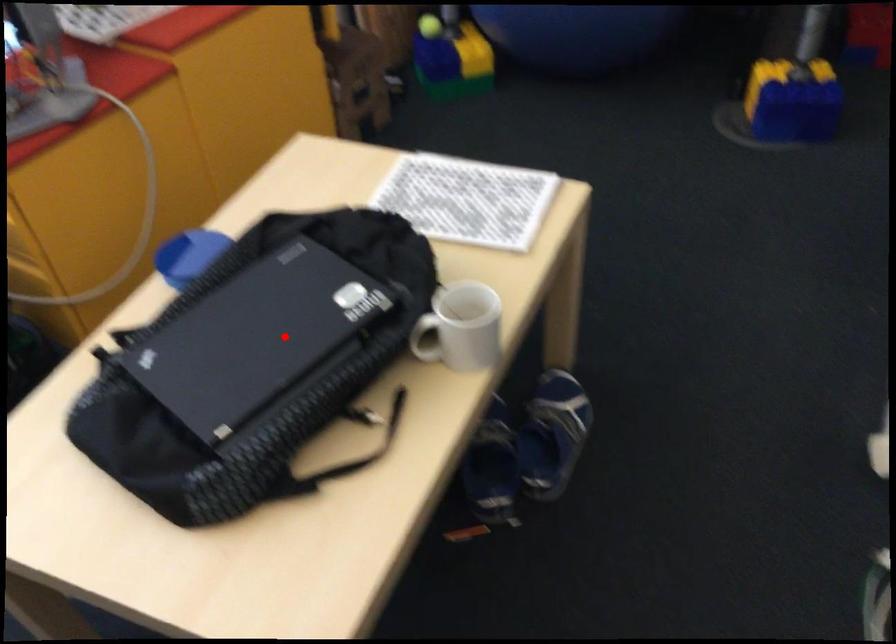
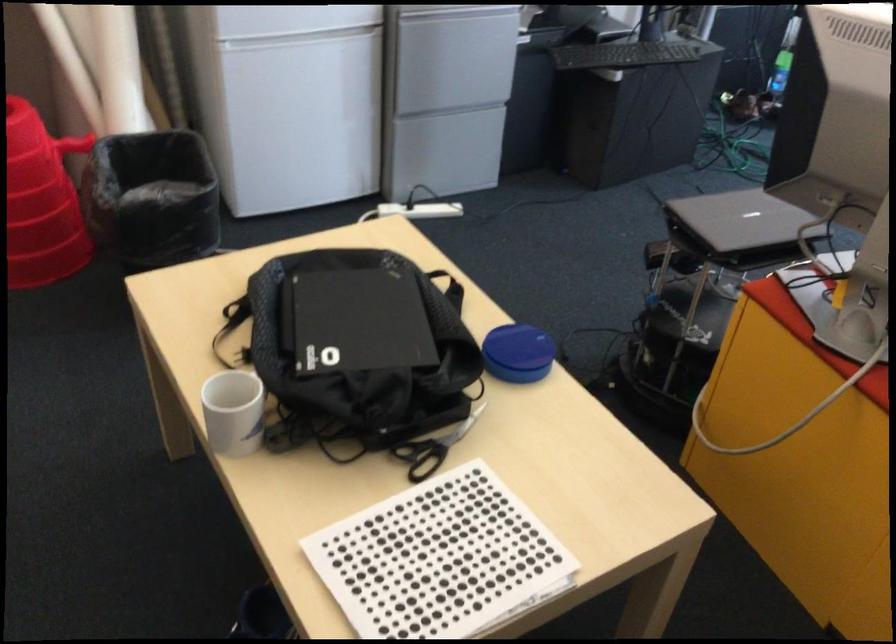
Question: I am providing you with two images of the same scene from different viewpoints. Given a red point in image1, look at the same physical point in image2. Is it:

Choices:
 (A) Closer to the viewpoint
 (B) Farther from the viewpoint

Answer: (B)